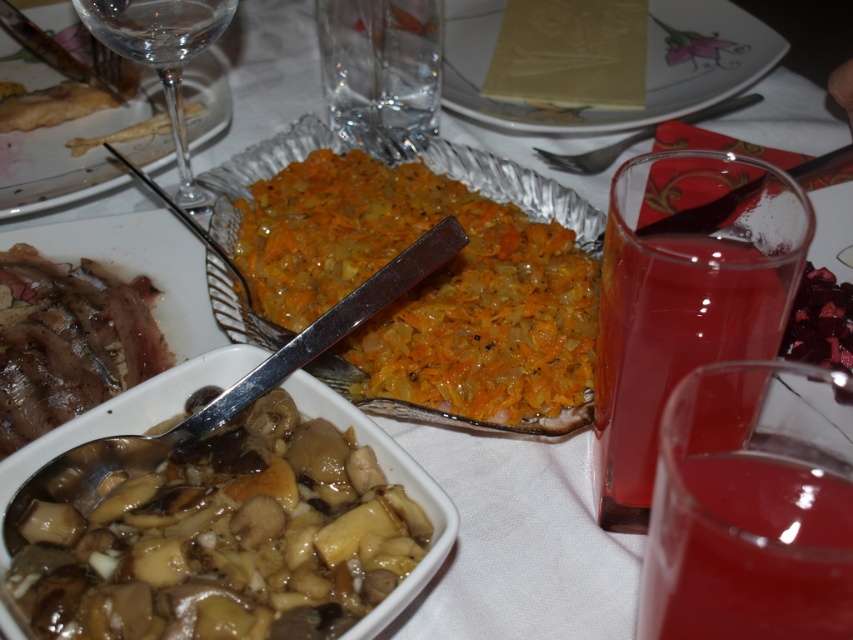
Which is above, orange shredded vegetable at center or shiny silver fork at upper left?

Positioned higher is shiny silver fork at upper left.

Between point (419, 356) and point (90, 141), which one is positioned behind?

The point (90, 141) is more distant.

Is point (399, 316) positioned before point (85, 148)?

Yes, point (399, 316) is in front of point (85, 148).

At what (x,y) coordinates should I click in order to perform the action: click on orange shredded vegetable at center. Please return your answer as a coordinate pair (x, y). Looking at the image, I should click on (427, 285).

Who is more forward, (x=299, y=176) or (x=489, y=104)?

Positioned in front is point (x=299, y=176).

Between orange shredded vegetable at center and white paper napkin at center, which one has less height?

Standing shorter between the two is white paper napkin at center.

Which is behind, point (459, 403) or point (697, 76)?

The point (697, 76) is more distant.

Find the location of a particular element. Image resolution: width=853 pixels, height=640 pixels. orange shredded vegetable at center is located at coordinates (427, 285).

Between dark red glossy berries at right and shiny silver fork at upper left, which one has more height?

Standing taller between the two is shiny silver fork at upper left.

Locate an element on the screen. The height and width of the screenshot is (640, 853). dark red glossy berries at right is located at coordinates (820, 321).